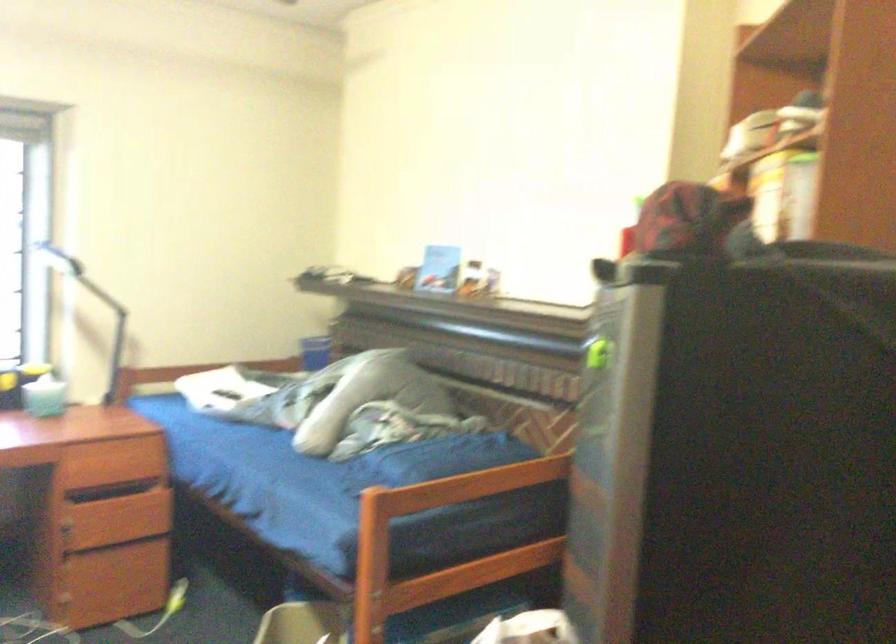
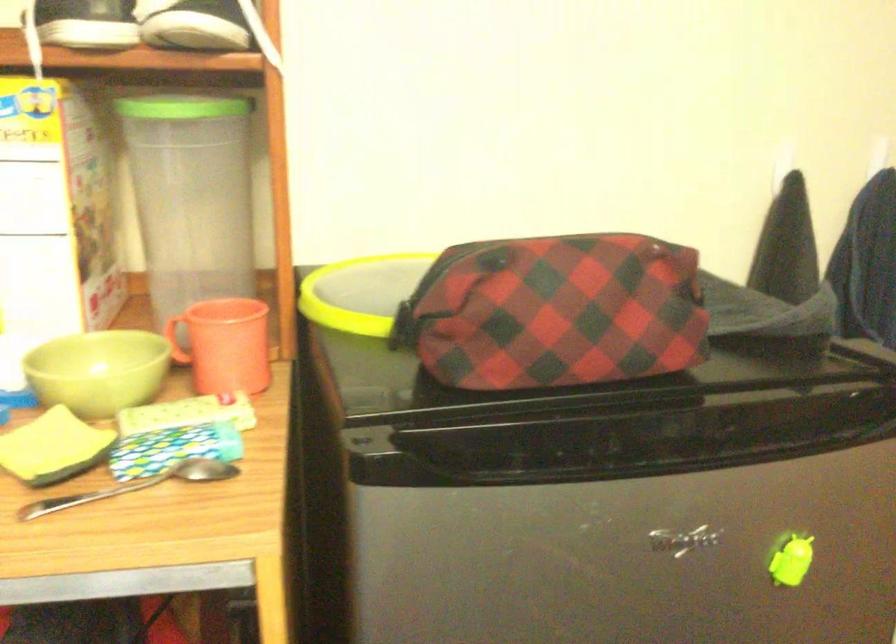
The point at (650, 249) is marked in the first image. Where is the corresponding point in the second image?

(556, 430)